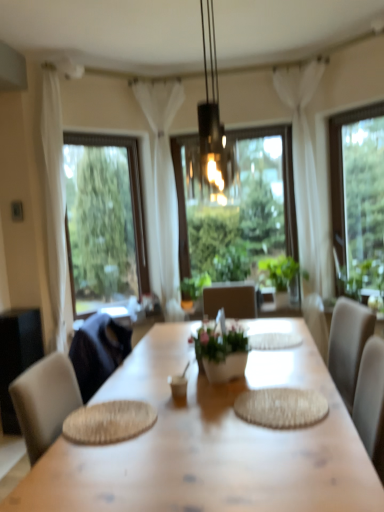
Question: Considering the relative sizes of black glass pendant light at center and green leafy plant at center, which appears as the second houseplant when viewed from the front, in the image provided, is black glass pendant light at center smaller than green leafy plant at center, which appears as the second houseplant when viewed from the front,?

Choices:
 (A) yes
 (B) no

Answer: (B)

Question: Does black glass pendant light at center have a lesser height compared to green leafy plant at center, which is the second houseplant in left-to-right order?

Choices:
 (A) yes
 (B) no

Answer: (B)

Question: From the image's perspective, is black glass pendant light at center under green leafy plant at center, which is the second houseplant in left-to-right order?

Choices:
 (A) no
 (B) yes

Answer: (A)

Question: Can you confirm if black glass pendant light at center is positioned to the left of green leafy plant at center, which is the second houseplant in left-to-right order?

Choices:
 (A) yes
 (B) no

Answer: (A)

Question: Is the depth of black glass pendant light at center less than that of green leafy plant at center, which is the second houseplant in left-to-right order?

Choices:
 (A) no
 (B) yes

Answer: (B)

Question: In the image, is transparent glass window at center, the second window when ordered from left to right, positioned in front of or behind black glass pendant light at center?

Choices:
 (A) behind
 (B) front

Answer: (A)

Question: Is point (271, 143) closer or farther from the camera than point (228, 183)?

Choices:
 (A) farther
 (B) closer

Answer: (A)

Question: Considering the positions of transparent glass window at center, the second window when ordered from left to right, and black glass pendant light at center in the image, is transparent glass window at center, the second window when ordered from left to right, taller or shorter than black glass pendant light at center?

Choices:
 (A) short
 (B) tall

Answer: (B)

Question: From a real-world perspective, is transparent glass window at center, the second window when ordered from left to right, physically located above or below black glass pendant light at center?

Choices:
 (A) above
 (B) below

Answer: (B)

Question: Which is correct: black glass pendant light at center is inside white sheer curtain at center, which is counted as the 2th curtain, starting from the right, or outside of it?

Choices:
 (A) inside
 (B) outside

Answer: (B)

Question: From a real-world perspective, is black glass pendant light at center positioned above or below white sheer curtain at center, which is counted as the 2th curtain, starting from the right?

Choices:
 (A) below
 (B) above

Answer: (B)

Question: Considering the positions of black glass pendant light at center and white sheer curtain at center, which is counted as the 2th curtain, starting from the right, in the image, is black glass pendant light at center taller or shorter than white sheer curtain at center, which is counted as the 2th curtain, starting from the right,?

Choices:
 (A) short
 (B) tall

Answer: (A)

Question: From the image's perspective, is black glass pendant light at center positioned above or below white sheer curtain at center, positioned as the 1th curtain in left-to-right order?

Choices:
 (A) below
 (B) above

Answer: (B)

Question: From the image's perspective, relative to green leafy plant at right, is clear glass window at left, which ranks as the 1th window in left-to-right order, above or below?

Choices:
 (A) below
 (B) above

Answer: (B)

Question: Would you say clear glass window at left, arranged as the third window when viewed from the right, is to the left or to the right of green leafy plant at right in the picture?

Choices:
 (A) right
 (B) left

Answer: (B)